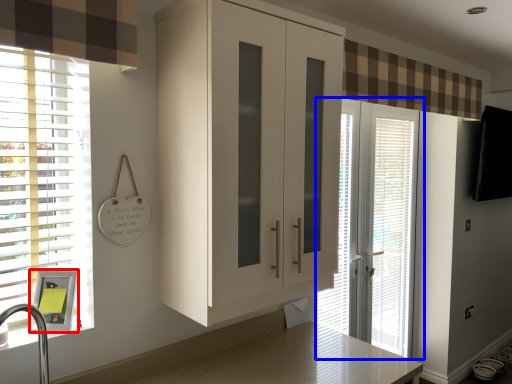
Question: Among these objects, which one is farthest to the camera, medicine cabinet (highlighted by a red box) or door (highlighted by a blue box)?

Choices:
 (A) medicine cabinet
 (B) door

Answer: (B)